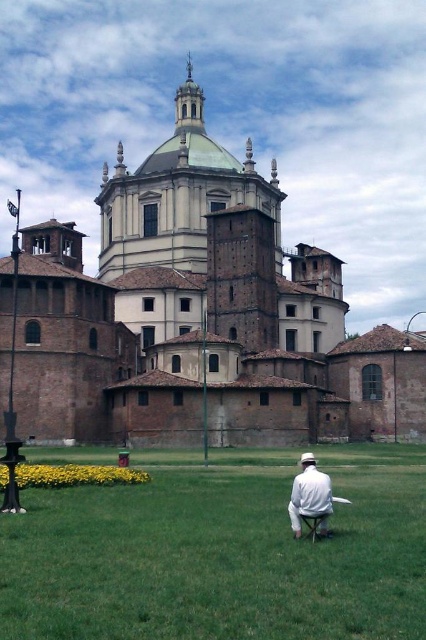
Question: Where is green grass at center located in relation to white cotton shirt at center in the image?

Choices:
 (A) left
 (B) right

Answer: (A)

Question: Which object appears farthest from the camera in this image?

Choices:
 (A) green grass at center
 (B) white cotton shirt at center
 (C) brown brick church at center

Answer: (C)

Question: Does brown brick church at center appear on the left side of green grass at center?

Choices:
 (A) yes
 (B) no

Answer: (B)

Question: Which object is positioned closest to the brown brick church at center?

Choices:
 (A) green grass at center
 (B) white cotton shirt at center

Answer: (A)

Question: Observing the image, what is the correct spatial positioning of brown brick church at center in reference to green grass at center?

Choices:
 (A) right
 (B) left

Answer: (A)

Question: Among these objects, which one is nearest to the camera?

Choices:
 (A) brown brick church at center
 (B) green grass at center

Answer: (B)